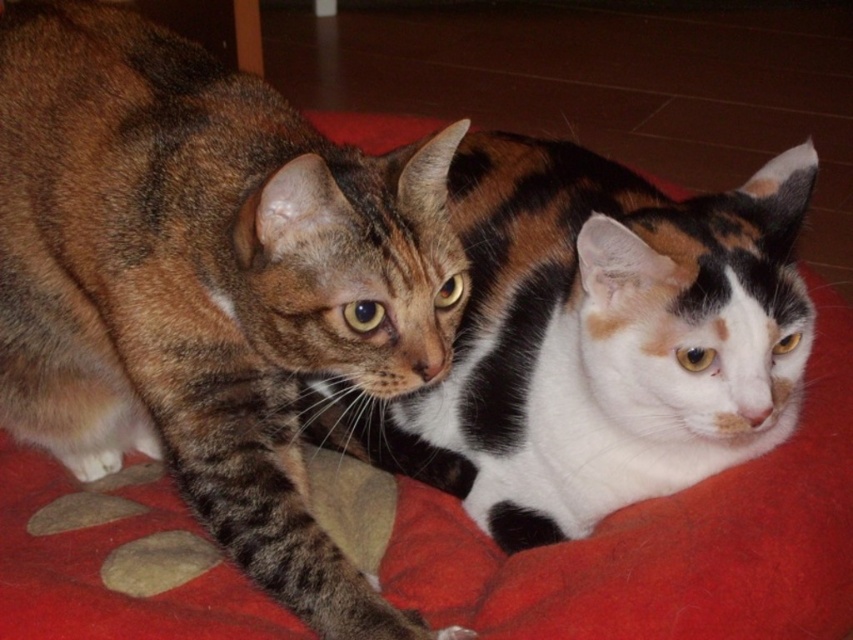
You are a cat owner who wants to ensure both cats have enough space to stretch out. Given that the red surface they are on is 1.2 meters long, can both the tabby fur cat at left and the tabby fur cat at center comfortably fit without overlapping?

The tabby fur cat at left is bigger than the tabby fur cat at center. Assuming the bigger cat takes up more space, the total required length would be more than 1.2 meters. Therefore, they cannot comfortably fit without overlapping on the 1.2 meter surface.

You are a cat owner who wants to place a small toy between the two cats. The toy requires 16 inches of space to fit. Can you determine if there is enough space between the tabby fur cat at left and the tabby fur cat at center to place the toy?

The tabby fur cat at left and tabby fur cat at center are 16.27 inches apart from each other, so yes, there is enough space to place the toy between them since the distance is slightly more than the required 16 inches.

You are observing two cats resting on a red cushion. You see the tabby fur cat at left and the tabby fur cat at center. Which cat is positioned more to the right?

The tabby fur cat at center is positioned more to the right than the tabby fur cat at left.